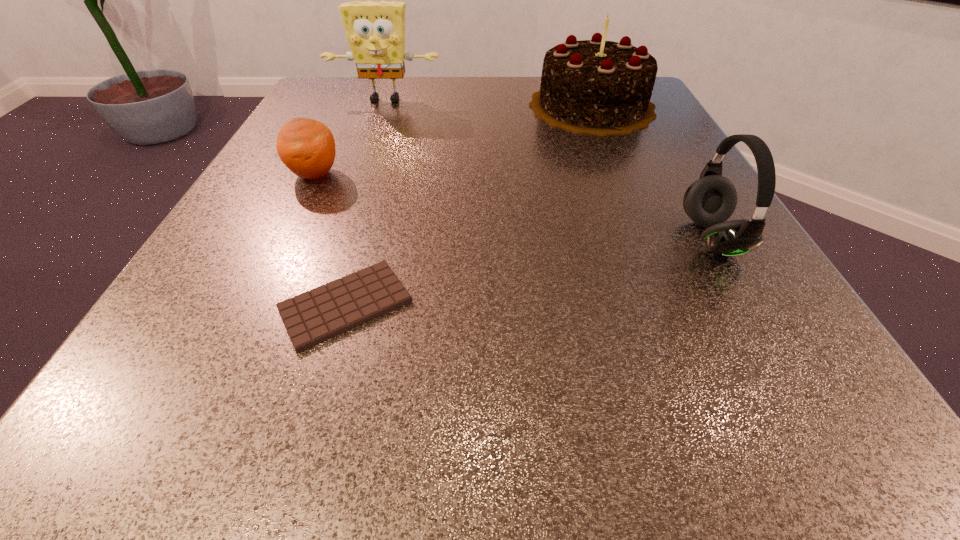
Where is `sponge`? The image size is (960, 540). sponge is located at coordinates (375, 30).

At what (x,y) coordinates should I click in order to perform the action: click on birthday cake. Please return your answer as a coordinate pair (x, y). Looking at the image, I should click on (598, 87).

This screenshot has height=540, width=960. I want to click on headset, so click(710, 201).

At what (x,y) coordinates should I click in order to perform the action: click on orange. Please return your answer as a coordinate pair (x, y). The width and height of the screenshot is (960, 540). Looking at the image, I should click on (306, 146).

This screenshot has height=540, width=960. Identify the location of the third farthest object. (306, 146).

Find the location of a particular element. The width and height of the screenshot is (960, 540). chocolate bar is located at coordinates (314, 316).

What are the coordinates of `vacant region located on the face of the sponge` in the screenshot? It's located at (378, 121).

Find the location of a particular element. Image resolution: width=960 pixels, height=540 pixels. vacant space positioned 0.260m on the left of the birthday cake is located at coordinates (409, 106).

I want to click on free spot located 0.190m on the ear cups of the headset, so click(556, 238).

This screenshot has height=540, width=960. Find the location of `vacant region located 0.160m on the ear cups of the headset`. vacant region located 0.160m on the ear cups of the headset is located at coordinates (576, 238).